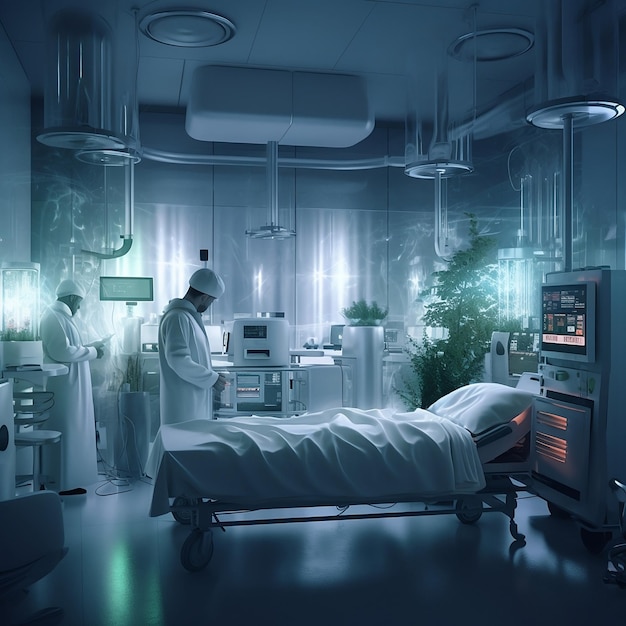
This screenshot has height=626, width=626. Find the location of `sheet`. sheet is located at coordinates (356, 447).